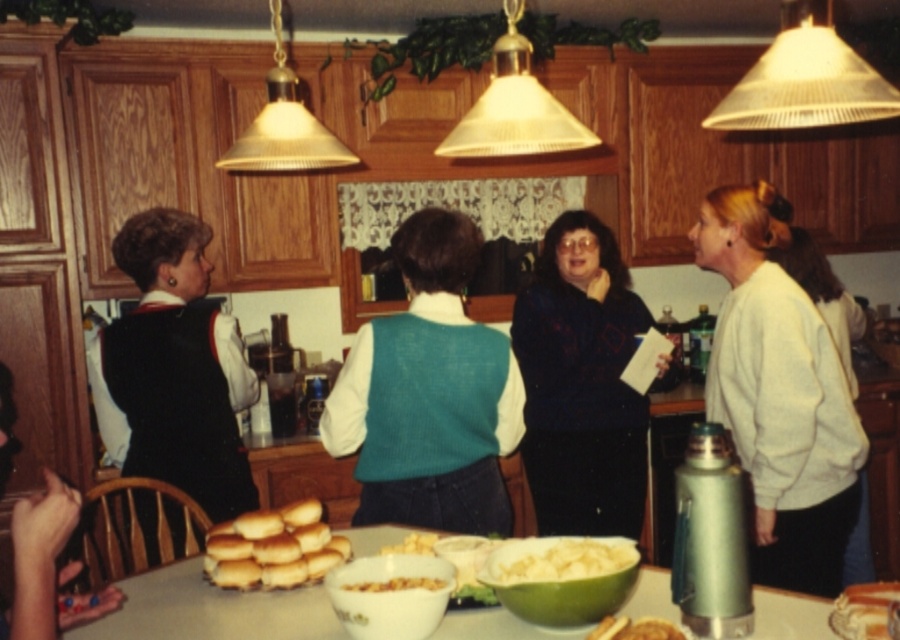
Based on the photo, does white creamy mashed potatoes at center have a lesser height compared to yellow crumbly at center?

No.

Is white creamy mashed potatoes at center bigger than yellow crumbly at center?

Correct, white creamy mashed potatoes at center is larger in size than yellow crumbly at center.

Is point (594, 540) farther from camera compared to point (398, 545)?

No, (594, 540) is in front of (398, 545).

I want to click on white creamy mashed potatoes at center, so click(569, 561).

Who is more distant from viewer, (590, 481) or (393, 586)?

The point (590, 481) is behind.

Is point (598, 348) farther from viewer compared to point (392, 586)?

Yes.

Find the location of `dark blue sweater at center`. dark blue sweater at center is located at coordinates tap(581, 384).

The image size is (900, 640). Describe the element at coordinates (581, 384) in the screenshot. I see `dark blue sweater at center` at that location.

Between dark blue sweater at center and black knit vest at left, which one has less height?

Standing shorter between the two is black knit vest at left.

This screenshot has width=900, height=640. In order to click on dark blue sweater at center in this screenshot , I will do `click(581, 384)`.